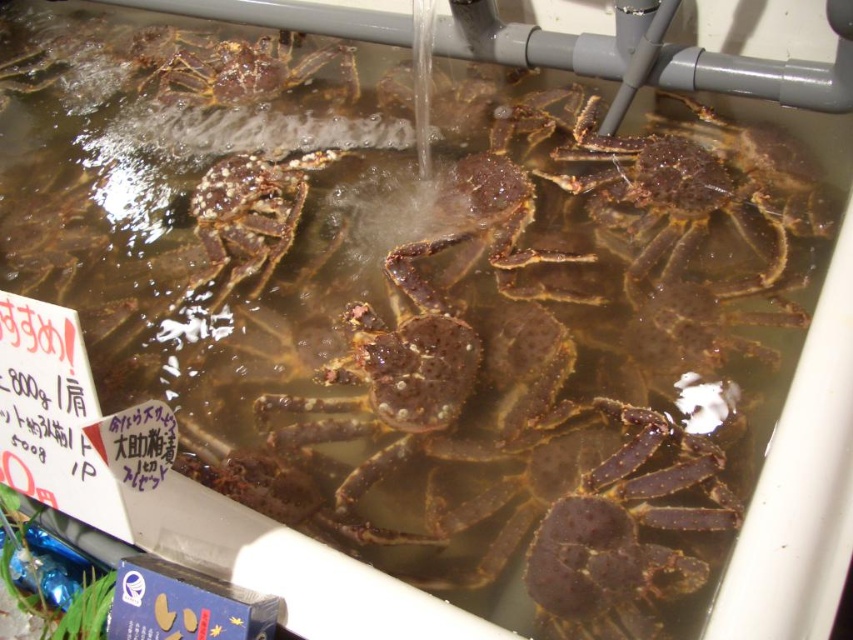
Question: Does speckled brown crab at center appear on the right side of brown rough crab at upper center?

Choices:
 (A) yes
 (B) no

Answer: (A)

Question: Which of the following is the closest to the observer?

Choices:
 (A) speckled brown crab at center
 (B) brown rough crab at upper center

Answer: (A)

Question: Is speckled brown crab at center closer to the viewer compared to brown rough crab at upper center?

Choices:
 (A) yes
 (B) no

Answer: (A)

Question: Among these objects, which one is farthest from the camera?

Choices:
 (A) brown rough crab at upper center
 (B) speckled brown crab at center

Answer: (A)

Question: Does speckled brown crab at center have a greater width compared to brown rough crab at upper center?

Choices:
 (A) yes
 (B) no

Answer: (B)

Question: Which object appears closest to the camera in this image?

Choices:
 (A) brown rough crab at upper center
 (B) speckled brown crab at center

Answer: (B)